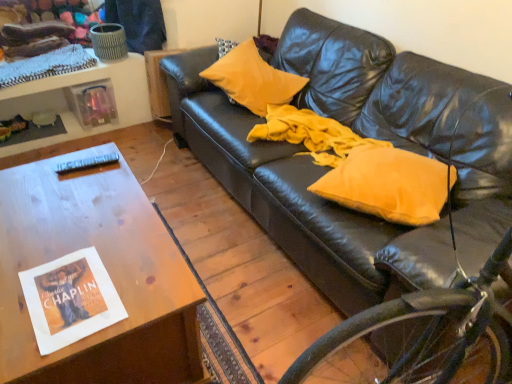
Question: Does black plastic remote control at upper left have a smaller size compared to leather couch at center?

Choices:
 (A) no
 (B) yes

Answer: (B)

Question: Is black plastic remote control at upper left positioned far away from leather couch at center?

Choices:
 (A) yes
 (B) no

Answer: (A)

Question: Can you confirm if black plastic remote control at upper left is positioned to the left of leather couch at center?

Choices:
 (A) yes
 (B) no

Answer: (A)

Question: Can you confirm if black plastic remote control at upper left is wider than leather couch at center?

Choices:
 (A) no
 (B) yes

Answer: (A)

Question: From a real-world perspective, does black plastic remote control at upper left stand above leather couch at center?

Choices:
 (A) no
 (B) yes

Answer: (A)

Question: Considering the relative sizes of black plastic remote control at upper left and leather couch at center in the image provided, is black plastic remote control at upper left thinner than leather couch at center?

Choices:
 (A) yes
 (B) no

Answer: (A)

Question: Is black plastic remote control at upper left positioned beyond the bounds of yellow fabric pillow at center, which is the 2th pillow in back-to-front order?

Choices:
 (A) no
 (B) yes

Answer: (B)

Question: Is black plastic remote control at upper left thinner than yellow fabric pillow at center, which is the first pillow in bottom-to-top order?

Choices:
 (A) no
 (B) yes

Answer: (B)

Question: Does black plastic remote control at upper left have a smaller size compared to yellow fabric pillow at center, which is the second pillow from left to right?

Choices:
 (A) yes
 (B) no

Answer: (A)

Question: Does black plastic remote control at upper left turn towards yellow fabric pillow at center, which is the 2th pillow from top to bottom?

Choices:
 (A) no
 (B) yes

Answer: (A)

Question: Is black plastic remote control at upper left positioned with its back to yellow fabric pillow at center, which is the 2th pillow from top to bottom?

Choices:
 (A) yes
 (B) no

Answer: (A)

Question: Considering the relative positions of black plastic remote control at upper left and yellow fabric pillow at center, which is the 2th pillow in back-to-front order, in the image provided, is black plastic remote control at upper left in front of yellow fabric pillow at center, which is the 2th pillow in back-to-front order,?

Choices:
 (A) yes
 (B) no

Answer: (B)

Question: From the image's perspective, is leather couch at center below yellow fabric pillow at center, which is the 1th pillow in front-to-back order?

Choices:
 (A) no
 (B) yes

Answer: (B)